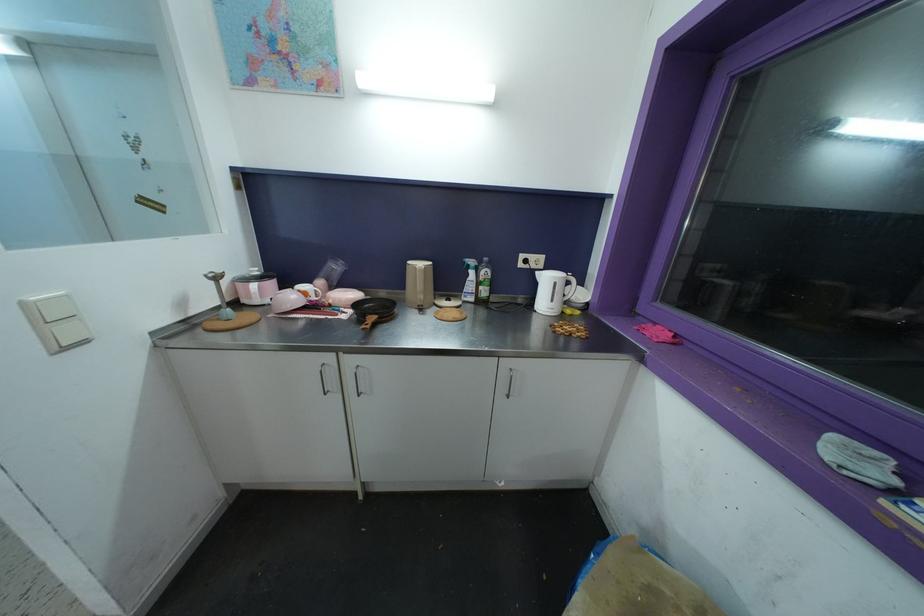
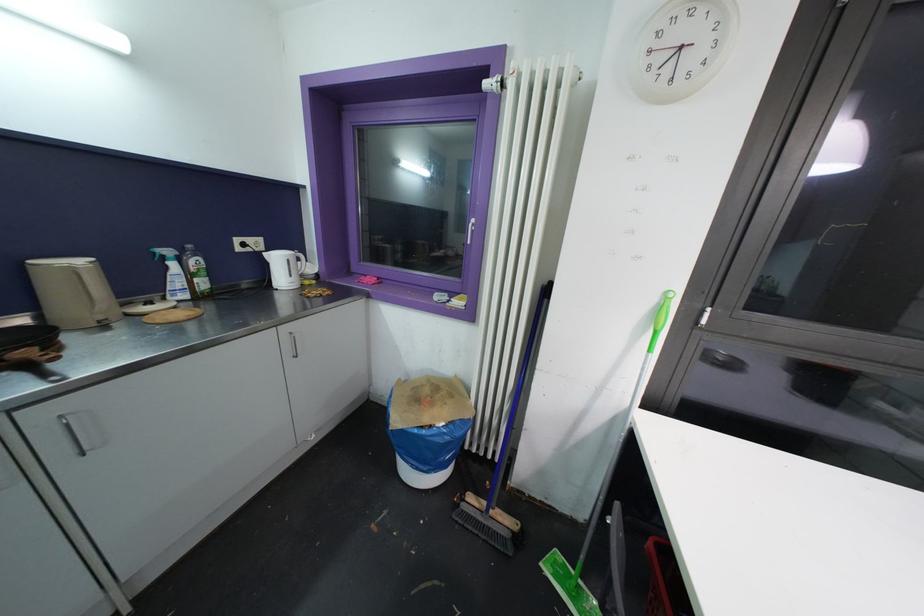
Locate, in the second image, the point that corresponds to (x=475, y=265) in the first image.

(171, 254)